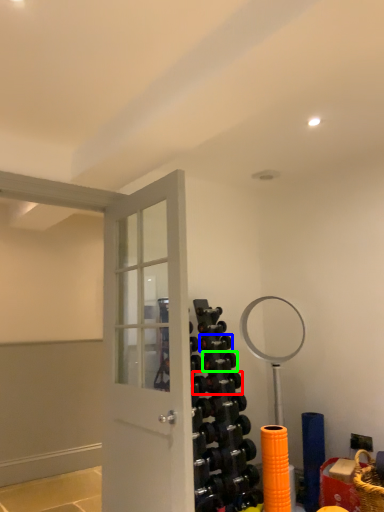
Question: Considering the real-world distances, which object is farthest from dumbbell (highlighted by a red box)? dumbbell (highlighted by a blue box) or dumbbell (highlighted by a green box)?

Choices:
 (A) dumbbell
 (B) dumbbell

Answer: (A)